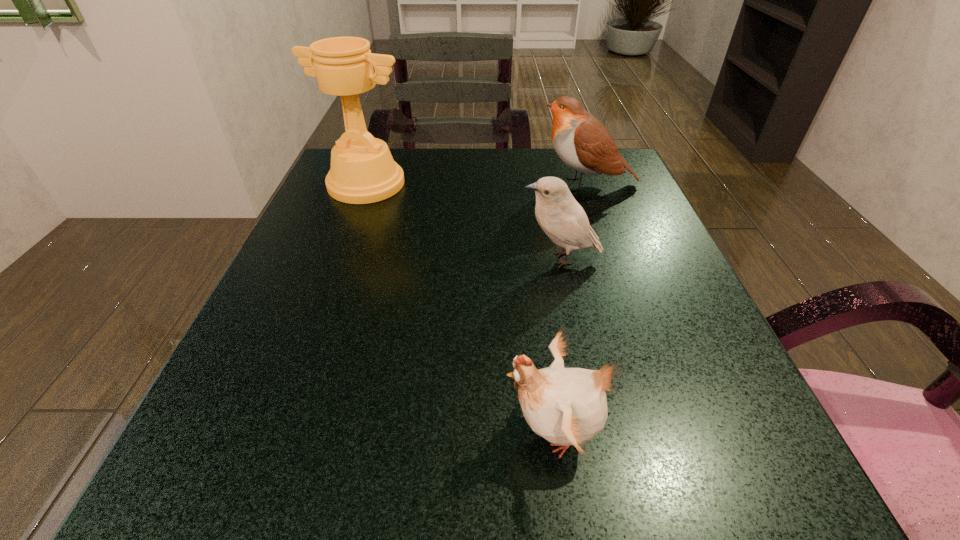
You are a GUI agent. You are given a task and a screenshot of the screen. Output one action in this format:
    pyautogui.click(x=<x>, y=<y>)
    Task: Click on the free space between the farthest bird and the nearest bird
    The height and width of the screenshot is (540, 960).
    Given the screenshot: What is the action you would take?
    pyautogui.click(x=570, y=308)

Point out which object is positioned as the third nearest to the nearest object. Please provide its 2D coordinates. Your answer should be formatted as a tuple, i.e. [(x, y)], where the tuple contains the x and y coordinates of a point satisfying the conditions above.

[(362, 171)]

Point out which object is positioned as the third nearest to the nearest object. Please provide its 2D coordinates. Your answer should be formatted as a tuple, i.e. [(x, y)], where the tuple contains the x and y coordinates of a point satisfying the conditions above.

[(362, 171)]

Identify which bird is the closest to the nearest bird. Please provide its 2D coordinates. Your answer should be formatted as a tuple, i.e. [(x, y)], where the tuple contains the x and y coordinates of a point satisfying the conditions above.

[(561, 217)]

Locate which bird is the closest to the second farthest bird. Please provide its 2D coordinates. Your answer should be formatted as a tuple, i.e. [(x, y)], where the tuple contains the x and y coordinates of a point satisfying the conditions above.

[(583, 143)]